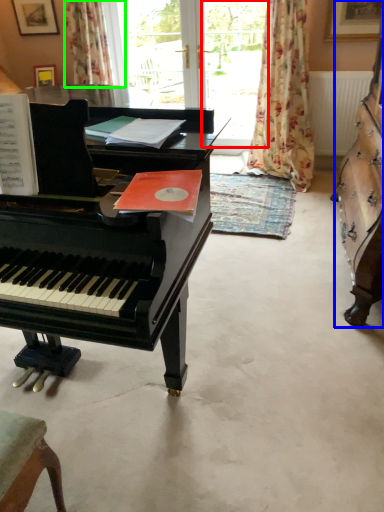
Question: Estimate the real-world distances between objects in this image. Which object is closer to window screen (highlighted by a red box), harpsichord (highlighted by a blue box) or curtain (highlighted by a green box)?

Choices:
 (A) harpsichord
 (B) curtain

Answer: (B)